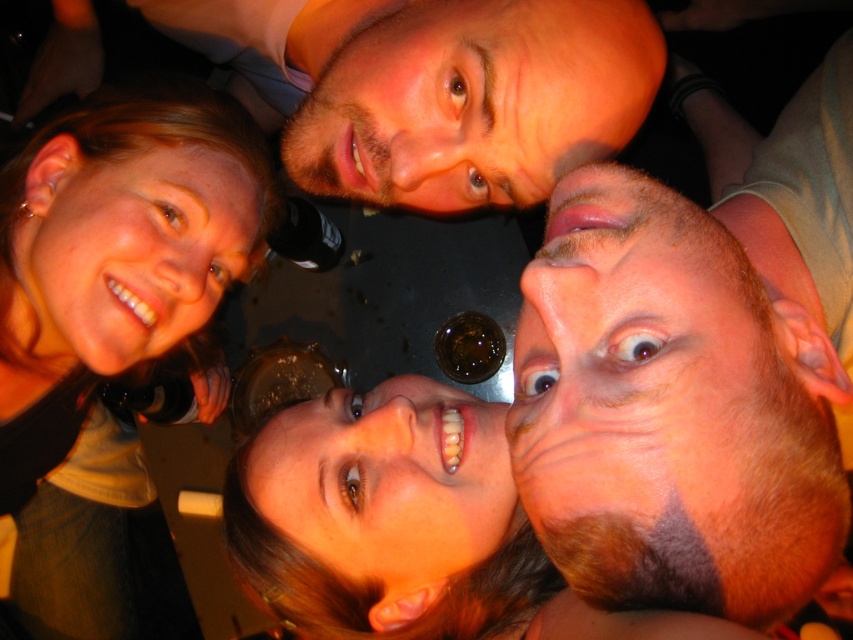
Question: Estimate the real-world distances between objects in this image. Which object is closer to the matte skin face at upper left?

Choices:
 (A) matte black hair at upper left
 (B) smooth skin face at center
 (C) bearded man at upper center
 (D) brown hair at center

Answer: (A)

Question: Does matte skin face at upper left have a lesser width compared to smooth skin face at center?

Choices:
 (A) yes
 (B) no

Answer: (B)

Question: Which of the following is the farthest from the observer?

Choices:
 (A) bearded man at upper center
 (B) brown hair at center
 (C) smooth skin face at center
 (D) matte black hair at upper left

Answer: (D)

Question: Estimate the real-world distances between objects in this image. Which object is farther from the smooth skin face at center?

Choices:
 (A) brown hair at center
 (B) matte black hair at upper left
 (C) matte skin face at upper left
 (D) bearded man at upper center

Answer: (B)

Question: Is matte black hair at upper left thinner than smooth skin face at center?

Choices:
 (A) yes
 (B) no

Answer: (B)

Question: Considering the relative positions of brown hair at center and smooth skin face at center in the image provided, where is brown hair at center located with respect to smooth skin face at center?

Choices:
 (A) below
 (B) above

Answer: (B)